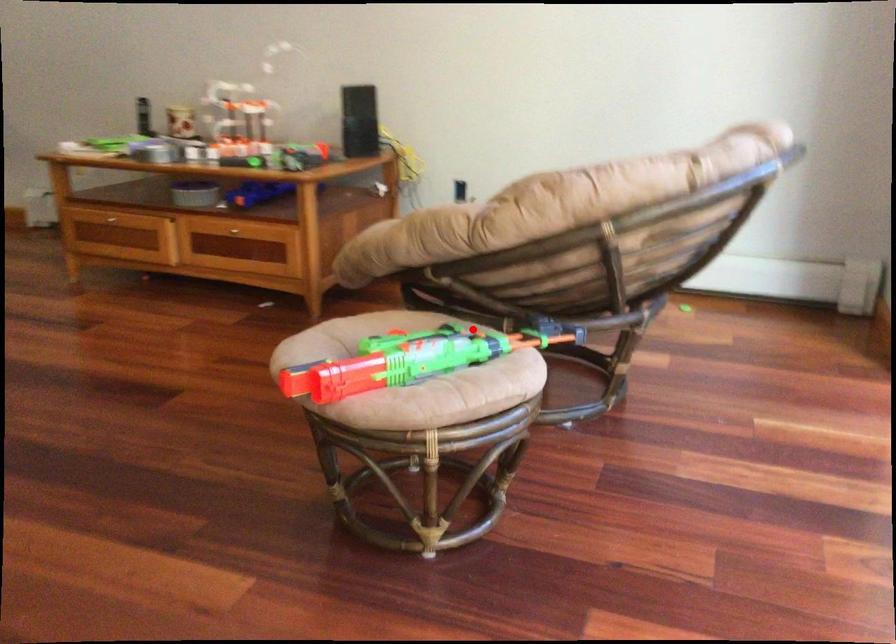
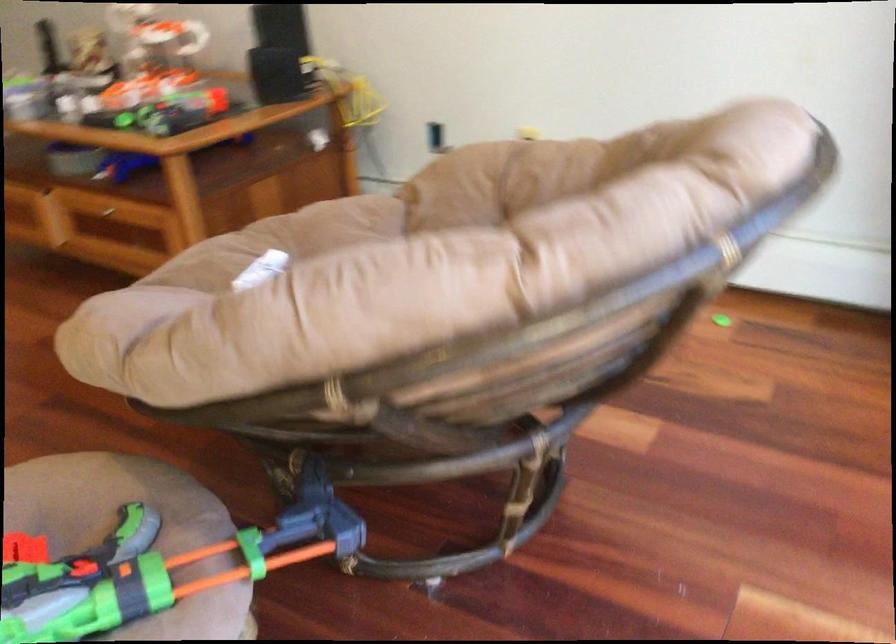
Question: I am providing you with two images of the same scene from different viewpoints. In image1, a red point is highlighted. Considering the same 3D point in image2, which of the following is correct?

Choices:
 (A) It is closer
 (B) It is farther

Answer: (A)